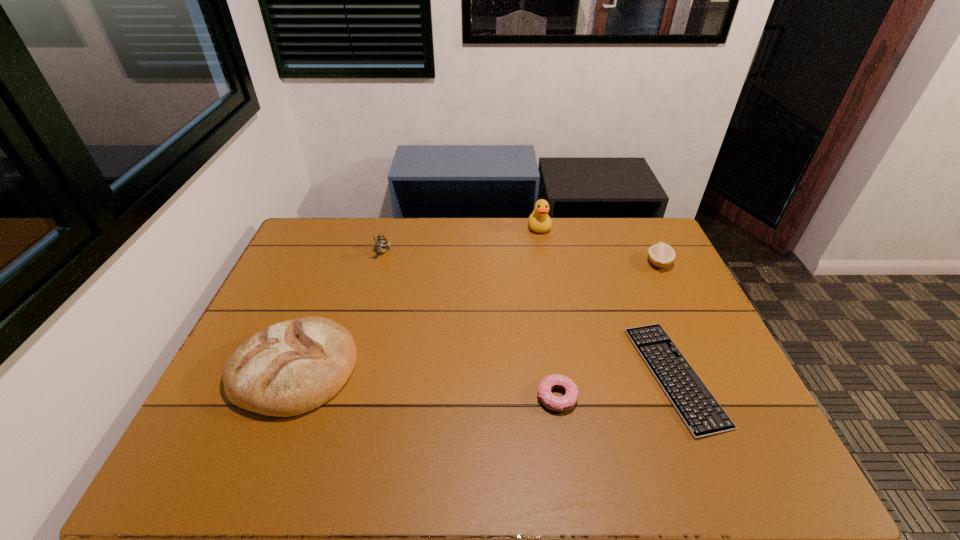
Identify the location of vacant region located on the front of the lemon. The height and width of the screenshot is (540, 960). (686, 321).

Find the location of a particular element. The height and width of the screenshot is (540, 960). blank space located 0.200m on the back of the second shortest object is located at coordinates point(546,323).

Where is `vacant region located 0.050m on the back of the shortest object`? This screenshot has width=960, height=540. vacant region located 0.050m on the back of the shortest object is located at coordinates (649, 313).

I want to click on duck at the far edge, so click(539, 221).

The height and width of the screenshot is (540, 960). In order to click on snail that is at the far edge in this screenshot , I will do `click(381, 243)`.

Where is `lemon situated at the far edge`? lemon situated at the far edge is located at coordinates (661, 255).

Locate an element on the screen. This screenshot has height=540, width=960. object present at the left edge is located at coordinates (292, 367).

The height and width of the screenshot is (540, 960). What are the coordinates of `lemon at the right edge` in the screenshot? It's located at (661, 255).

At what (x,y) coordinates should I click in order to perform the action: click on computer keyboard present at the right edge. Please return your answer as a coordinate pair (x, y). The image size is (960, 540). Looking at the image, I should click on (700, 411).

Image resolution: width=960 pixels, height=540 pixels. I want to click on object at the far right corner, so click(661, 255).